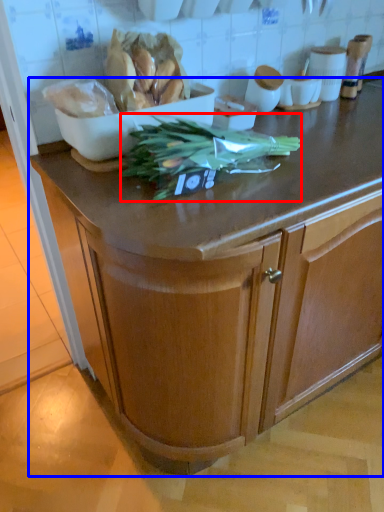
Question: Which object is further to the camera taking this photo, vegetable (highlighted by a red box) or cabinetry (highlighted by a blue box)?

Choices:
 (A) vegetable
 (B) cabinetry

Answer: (A)